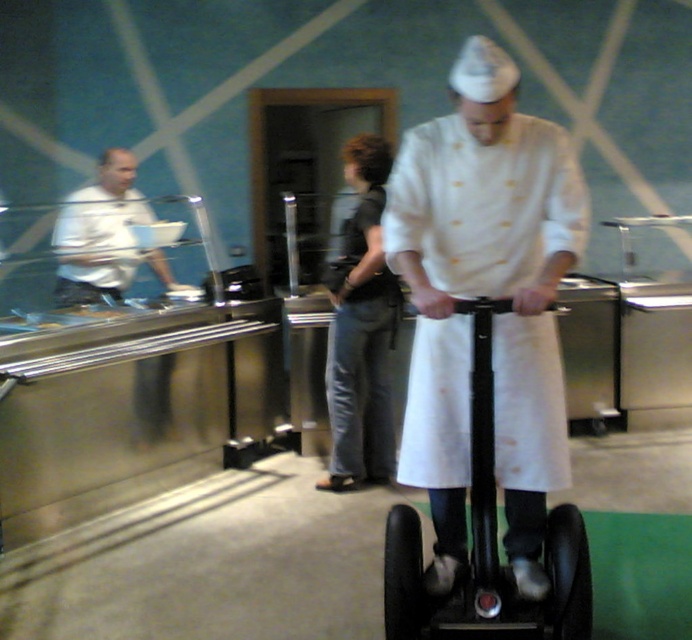
Question: Is white matte chef coat at center to the left of black rubber scooter at center from the viewer's perspective?

Choices:
 (A) yes
 (B) no

Answer: (A)

Question: Is white matte chef coat at center smaller than black rubber scooter at center?

Choices:
 (A) yes
 (B) no

Answer: (B)

Question: Considering the real-world distances, which object is closest to the black rubber scooter at center?

Choices:
 (A) white matte chef coat at center
 (B) white matte shirt at left

Answer: (A)

Question: Does white matte chef coat at center appear on the left side of black rubber scooter at center?

Choices:
 (A) yes
 (B) no

Answer: (A)

Question: Among these objects, which one is nearest to the camera?

Choices:
 (A) white matte shirt at left
 (B) white matte chef coat at center

Answer: (B)

Question: Which of these objects is positioned closest to the black rubber scooter at center?

Choices:
 (A) white matte chef coat at center
 (B) white matte shirt at left

Answer: (A)